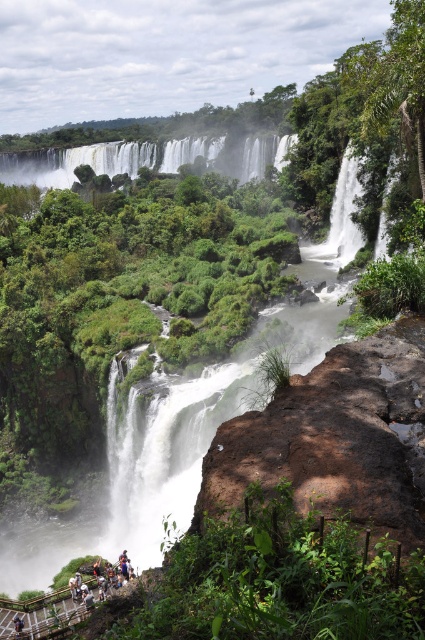
Which is more to the right, white frothy water at center or white cotton shirt at lower left?

From the viewer's perspective, white cotton shirt at lower left appears more on the right side.

How distant is white frothy water at center from white cotton shirt at lower left?

white frothy water at center and white cotton shirt at lower left are 442.77 feet apart.

I want to click on white frothy water at center, so click(x=147, y=157).

Locate an element on the screen. The width and height of the screenshot is (425, 640). white frothy water at center is located at coordinates pos(147,157).

Is point (121, 556) more distant than point (17, 627)?

Yes, it is.

Between point (91, 570) and point (20, 632), which one is positioned behind?

The point (91, 570) is behind.

In the scene shown: Who is more forward, (98,577) or (16,627)?

Point (16,627) is in front.

At what (x,y) coordinates should I click in order to perform the action: click on white cotton shirt at lower left. Please return your answer as a coordinate pair (x, y). This screenshot has width=425, height=640. Looking at the image, I should click on (105, 573).

Does white frothy water at center appear over dark blue jeans at lower left?

Yes, white frothy water at center is above dark blue jeans at lower left.

Looking at this image, between white frothy water at center and dark blue jeans at lower left, which one appears on the left side from the viewer's perspective?

From the viewer's perspective, white frothy water at center appears more on the left side.

Where is `white frothy water at center`? white frothy water at center is located at coordinates (147, 157).

Where is `white frothy water at center`? white frothy water at center is located at coordinates (147, 157).